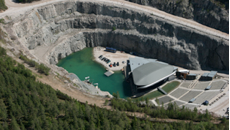
The image size is (230, 130). I want to click on sectioned seating areas on the bottom right, so click(x=184, y=83), click(x=199, y=86), click(x=218, y=84), click(x=179, y=92), click(x=190, y=98), click(x=205, y=98), click(x=166, y=98), click(x=175, y=104).